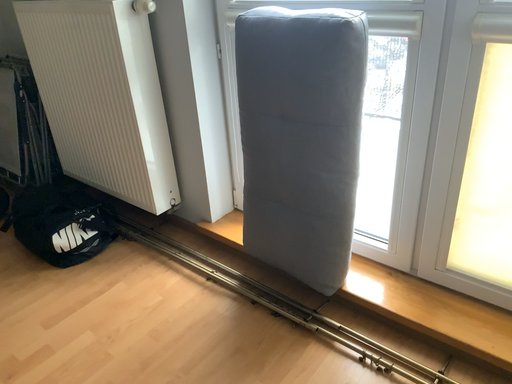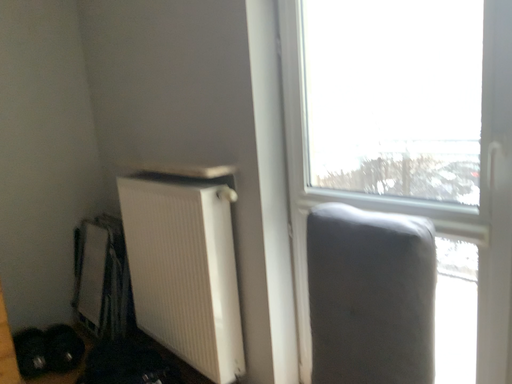
Question: How did the camera likely rotate when shooting the video?

Choices:
 (A) rotated right
 (B) rotated left

Answer: (B)